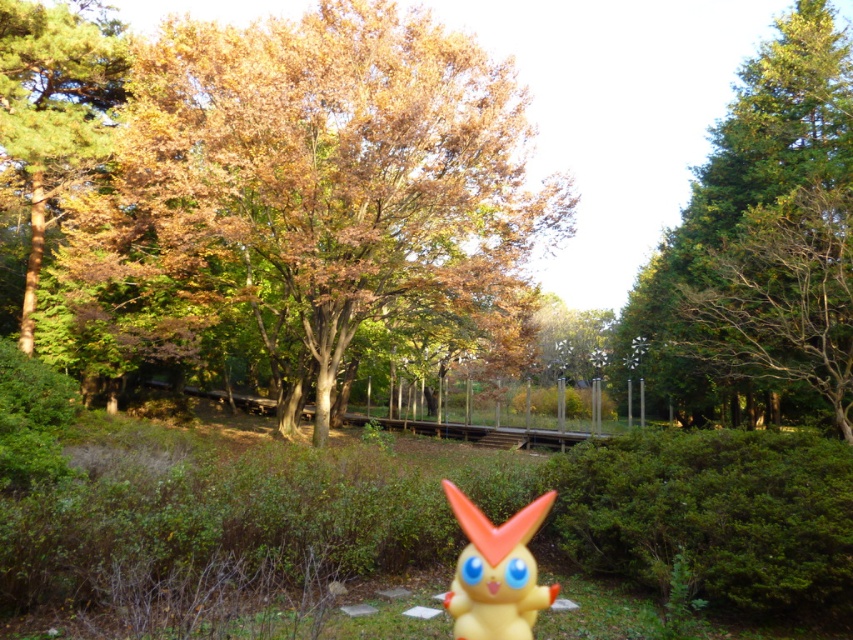
Image resolution: width=853 pixels, height=640 pixels. I want to click on green textured tree at right, so click(x=762, y=241).

Between point (769, 458) and point (827, 237), which one is positioned behind?

The point (827, 237) is behind.

Who is lower down, green leafy hedge at center or brown/dry wood at upper right?

Positioned lower is green leafy hedge at center.

Is point (669, 522) more distant than point (740, 346)?

That is False.

Find the location of a particular element. green leafy hedge at center is located at coordinates 712,515.

Does golden-brown foliage at upper center appear on the left side of green textured tree at right?

Yes, golden-brown foliage at upper center is to the left of green textured tree at right.

Between golden-brown foliage at upper center and green textured tree at right, which one is positioned higher?

green textured tree at right is above.

Which is behind, point (387, 19) or point (840, 244)?

Positioned behind is point (387, 19).

Identify the location of golden-brown foliage at upper center. (321, 188).